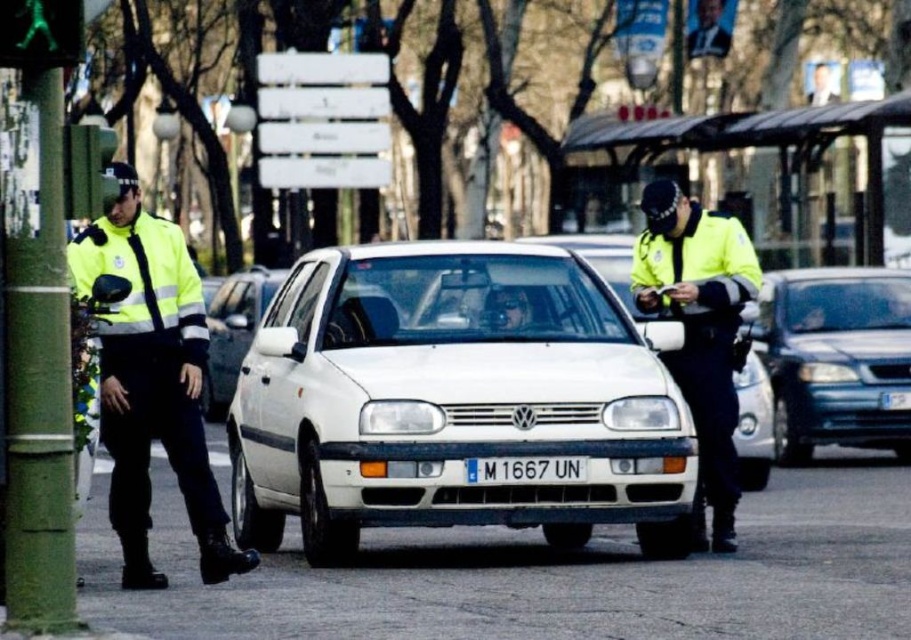
Question: Which of the following is the closest to the observer?

Choices:
 (A) white matte hatchback at center
 (B) high visibility yellow jacket at left

Answer: (B)

Question: Which of the following is the closest to the observer?

Choices:
 (A) white matte hatchback at center
 (B) high visibility yellow jacket at center
 (C) high visibility yellow jacket at left
 (D) white plastic license plate at center

Answer: (C)

Question: Where is high visibility yellow jacket at left located in relation to blue metallic sedan at right in the image?

Choices:
 (A) below
 (B) above

Answer: (A)

Question: Does blue metallic sedan at right appear over white plastic license plate at center?

Choices:
 (A) yes
 (B) no

Answer: (A)

Question: Is white matte hatchback at center behind high visibility yellow jacket at left?

Choices:
 (A) yes
 (B) no

Answer: (A)

Question: Among these objects, which one is farthest from the camera?

Choices:
 (A) white matte hatchback at center
 (B) high visibility yellow jacket at center

Answer: (B)